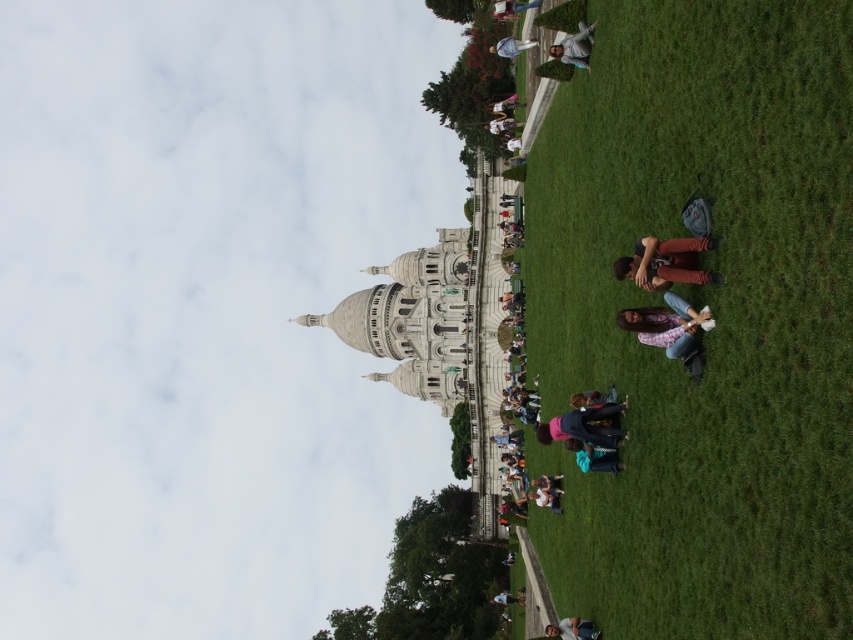
From the picture: You are taking a photo of the Basilica of the Sacred Heart of Paris and notice two items in the foreground. Which item is closer to the camera between the light brown leather jacket at center and the blue denim jeans at lower center?

The light brown leather jacket at center is closer to the camera because it is in front of the blue denim jeans at lower center.

You are a photographer standing at the center of the grassy area in front of the Sacre Coeur Basilica. You want to take a photo of the brown leather jacket at lower right. Where should you position yourself to capture the jacket in the frame?

To capture the brown leather jacket at lower right in the frame, position yourself so that the jacket is located at the coordinates corresponding to point 0.411 on the horizontal axis and 0.781 on the vertical axis within your camera viewfinder.

You are standing on the grassy area in front of the Sacre Coeur Basilica. You see a person wearing a floral shirt at lower center and another wearing denim pants at upper center. Which clothing item is positioned lower in the image?

The floral shirt at lower center is positioned lower in the image than the denim pants at upper center.